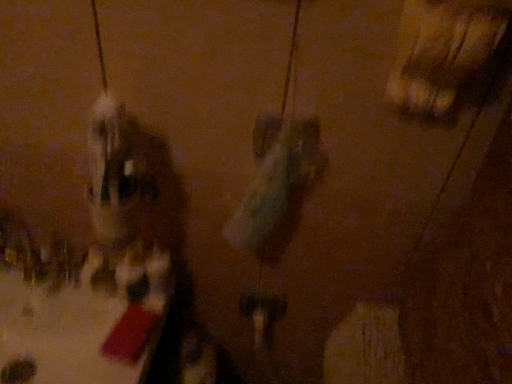
Question: Should I look upward or downward to see wooden chair at upper right?

Choices:
 (A) down
 (B) up

Answer: (B)